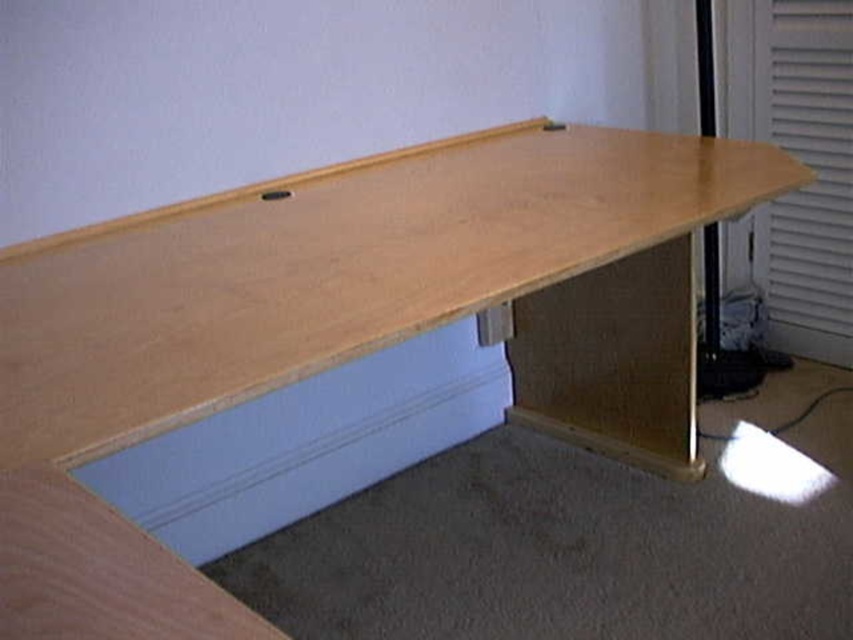
Question: Can you confirm if light blue plastic drawer at lower center is bigger than white textured blind at right?

Choices:
 (A) yes
 (B) no

Answer: (A)

Question: Among these points, which one is nearest to the camera?

Choices:
 (A) (440, 433)
 (B) (790, 227)

Answer: (A)

Question: Is light blue plastic drawer at lower center to the right of white textured blind at right from the viewer's perspective?

Choices:
 (A) no
 (B) yes

Answer: (A)

Question: Does light blue plastic drawer at lower center appear on the right side of white textured blind at right?

Choices:
 (A) no
 (B) yes

Answer: (A)